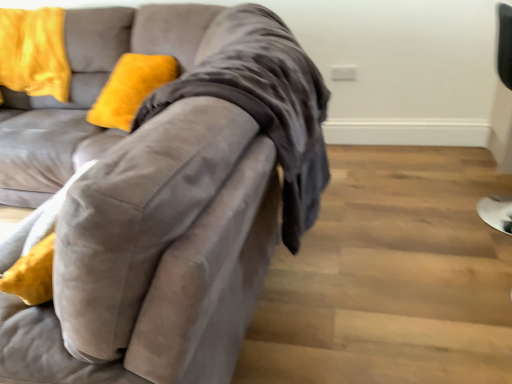
You are a GUI agent. You are given a task and a screenshot of the screen. Output one action in this format:
    pyautogui.click(x=<x>, y=<y>)
    Task: Click on the free space to the left of black leather chair at right
    
    Given the screenshot: What is the action you would take?
    coord(420,225)